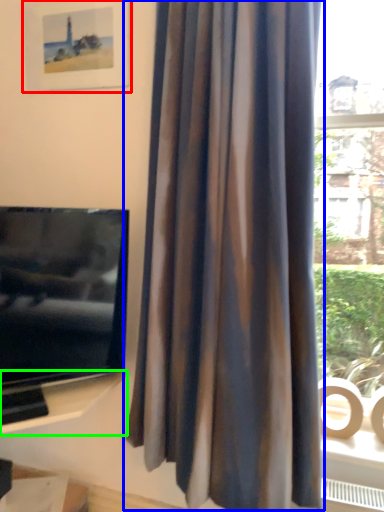
Question: Which is farther away from picture frame (highlighted by a red box)? curtain (highlighted by a blue box) or shelf (highlighted by a green box)?

Choices:
 (A) curtain
 (B) shelf

Answer: (B)